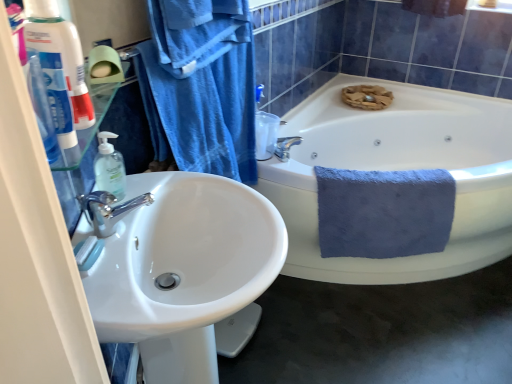
Question: From a real-world perspective, is blue cotton towel at upper left, the 1th bath towel in the front-to-back sequence, positioned under white ceramic bathtub at center based on gravity?

Choices:
 (A) yes
 (B) no

Answer: (B)

Question: From the image's perspective, does blue cotton towel at upper left, the 2th bath towel viewed from the back, appear lower than white ceramic bathtub at center?

Choices:
 (A) no
 (B) yes

Answer: (A)

Question: Is the position of blue cotton towel at upper left, the second bath towel from the right, more distant than that of white ceramic bathtub at center?

Choices:
 (A) yes
 (B) no

Answer: (B)

Question: Can we say blue cotton towel at upper left, the 2th bath towel viewed from the back, lies outside white ceramic bathtub at center?

Choices:
 (A) no
 (B) yes

Answer: (B)

Question: Does blue cotton towel at upper left, arranged as the first bath towel when viewed from the left, touch white ceramic bathtub at center?

Choices:
 (A) no
 (B) yes

Answer: (A)

Question: Considering the relative sizes of blue cotton towel at upper left, the second bath towel from the right, and white ceramic bathtub at center in the image provided, is blue cotton towel at upper left, the second bath towel from the right, wider than white ceramic bathtub at center?

Choices:
 (A) no
 (B) yes

Answer: (A)

Question: From a real-world perspective, is white ceramic bathtub at center over white glossy sink at left?

Choices:
 (A) yes
 (B) no

Answer: (B)

Question: Does white ceramic bathtub at center have a larger size compared to white glossy sink at left?

Choices:
 (A) yes
 (B) no

Answer: (A)

Question: Can you confirm if white ceramic bathtub at center is smaller than white glossy sink at left?

Choices:
 (A) yes
 (B) no

Answer: (B)

Question: Considering the relative sizes of white ceramic bathtub at center and white glossy sink at left in the image provided, is white ceramic bathtub at center shorter than white glossy sink at left?

Choices:
 (A) no
 (B) yes

Answer: (B)

Question: Considering the relative positions of white ceramic bathtub at center and white glossy sink at left in the image provided, is white ceramic bathtub at center to the left of white glossy sink at left from the viewer's perspective?

Choices:
 (A) no
 (B) yes

Answer: (A)

Question: From the image's perspective, does white ceramic bathtub at center appear lower than white glossy sink at left?

Choices:
 (A) yes
 (B) no

Answer: (B)

Question: Is white glossy toothpaste tube at left positioned in front of blue fluffy towel at right, which is the 1th bath towel from right to left?

Choices:
 (A) no
 (B) yes

Answer: (B)